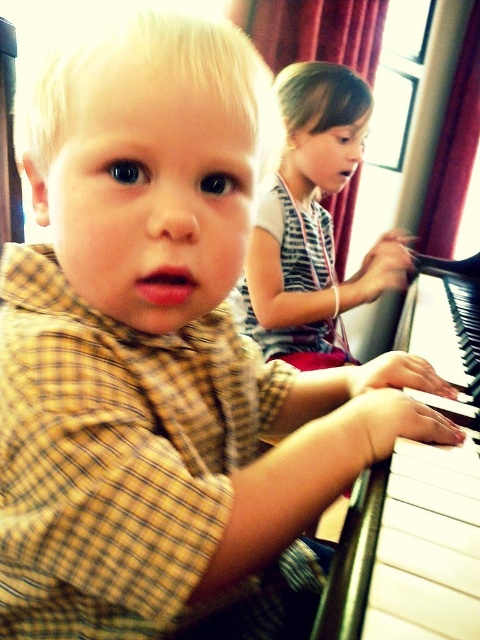
You are a photographer trying to capture a photo of both the white glossy piano at right and the striped fabric shirt at upper center in the same frame. Based on their positions, which object is located to the right of the other?

The white glossy piano at right is positioned on the right side of striped fabric shirt at upper center, so the piano is to the right of the striped fabric shirt at upper center.

Based on the photo, you are a photographer trying to capture a candid shot of both children in the scene. The white glossy piano at right and the striped fabric shirt at upper center are key elements. Based on their positions, which object is positioned lower in the frame?

The white glossy piano at right is positioned below the striped fabric shirt at upper center, so the piano is lower in the frame.

You are a photographer trying to capture a candid shot of both children. You notice the white glossy piano at right and the striped fabric shirt at upper center. Which object is positioned closer to you, the photographer?

The white glossy piano at right is closer to the viewer than the striped fabric shirt at upper center, so the piano is closer to you.